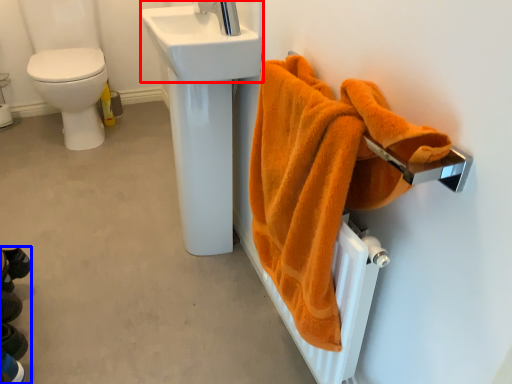
Question: Which point is further to the camera, sink (highlighted by a red box) or squat (highlighted by a blue box)?

Choices:
 (A) sink
 (B) squat

Answer: (A)